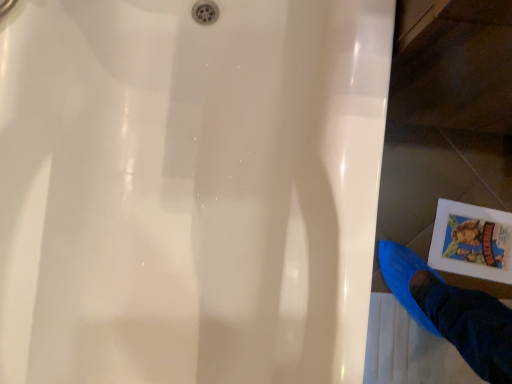
Find the location of a particular element. free space above blue fabric foot at lower right (from a real-world perspective) is located at coordinates (414, 350).